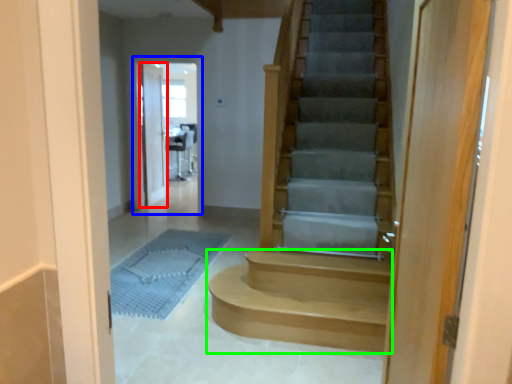
Question: Which object is positioned closest to door (highlighted by a red box)? Select from screen door (highlighted by a blue box) and stairs (highlighted by a green box).

Choices:
 (A) screen door
 (B) stairs

Answer: (A)